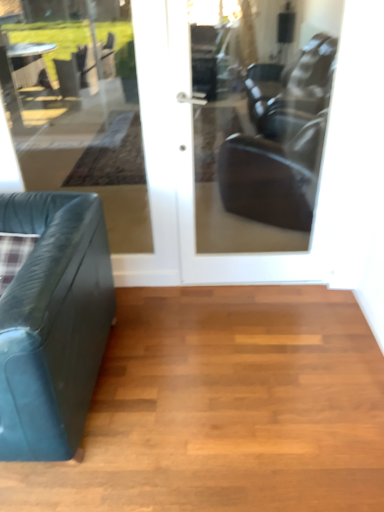
Question: Can you confirm if matte glass door at center is taller than teal leather studio couch at left?

Choices:
 (A) yes
 (B) no

Answer: (A)

Question: From the image's perspective, would you say matte glass door at center is shown under teal leather studio couch at left?

Choices:
 (A) no
 (B) yes

Answer: (A)

Question: Can you confirm if matte glass door at center is shorter than teal leather studio couch at left?

Choices:
 (A) no
 (B) yes

Answer: (A)

Question: Is matte glass door at center aimed at teal leather studio couch at left?

Choices:
 (A) no
 (B) yes

Answer: (A)

Question: Considering the relative sizes of matte glass door at center and teal leather studio couch at left in the image provided, is matte glass door at center wider than teal leather studio couch at left?

Choices:
 (A) yes
 (B) no

Answer: (B)

Question: Based on their sizes in the image, would you say matte glass door at center is bigger or smaller than transparent glass door at center?

Choices:
 (A) big
 (B) small

Answer: (A)

Question: Considering their positions, is matte glass door at center located in front of or behind transparent glass door at center?

Choices:
 (A) behind
 (B) front

Answer: (B)

Question: From a real-world perspective, is matte glass door at center positioned above or below transparent glass door at center?

Choices:
 (A) below
 (B) above

Answer: (A)

Question: Is matte glass door at center taller or shorter than transparent glass door at center?

Choices:
 (A) short
 (B) tall

Answer: (A)

Question: Considering the positions of point (188, 352) and point (39, 54), is point (188, 352) closer or farther from the camera than point (39, 54)?

Choices:
 (A) closer
 (B) farther

Answer: (A)

Question: Is shiny brown hardwood floor at lower left taller or shorter than transparent glass door at center?

Choices:
 (A) tall
 (B) short

Answer: (B)

Question: Is shiny brown hardwood floor at lower left bigger or smaller than transparent glass door at center?

Choices:
 (A) small
 (B) big

Answer: (B)

Question: Visually, is shiny brown hardwood floor at lower left positioned to the left or to the right of transparent glass door at center?

Choices:
 (A) left
 (B) right

Answer: (B)

Question: From a real-world perspective, is matte glass door at center above or below shiny brown hardwood floor at lower left?

Choices:
 (A) below
 (B) above

Answer: (B)

Question: Which is correct: matte glass door at center is inside shiny brown hardwood floor at lower left, or outside of it?

Choices:
 (A) inside
 (B) outside

Answer: (B)